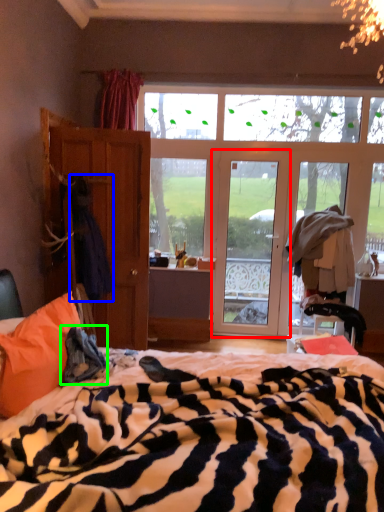
Question: Estimate the real-world distances between objects in this image. Which object is farther from door (highlighted by a red box), laundry (highlighted by a blue box) or cloth (highlighted by a green box)?

Choices:
 (A) laundry
 (B) cloth

Answer: (B)